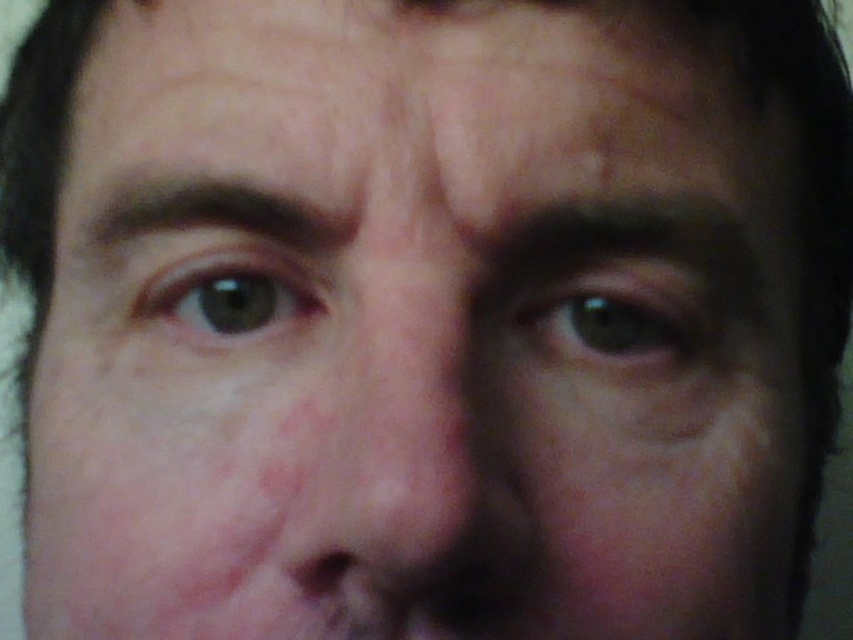
Question: Can you confirm if smooth skin nose at center is thinner than green matte eye at center?

Choices:
 (A) yes
 (B) no

Answer: (A)

Question: Is green matte eye at center to the left of green matte eye at upper left from the viewer's perspective?

Choices:
 (A) yes
 (B) no

Answer: (B)

Question: Which of the following is the farthest from the observer?

Choices:
 (A) green matte eye at center
 (B) smooth skin nose at center
 (C) green matte eye at upper left

Answer: (A)

Question: Which point is closer to the camera?

Choices:
 (A) green matte eye at center
 (B) green matte eye at upper left

Answer: (B)

Question: Does green matte eye at center have a smaller size compared to green matte eye at upper left?

Choices:
 (A) yes
 (B) no

Answer: (B)

Question: Which point appears closest to the camera in this image?

Choices:
 (A) (312, 557)
 (B) (166, 269)

Answer: (A)